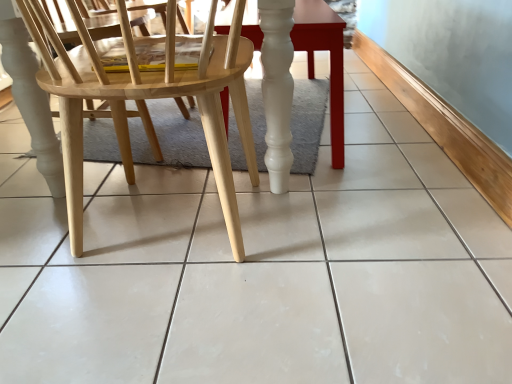
The image size is (512, 384). I want to click on free space in front of natural wood chair at left, so click(173, 342).